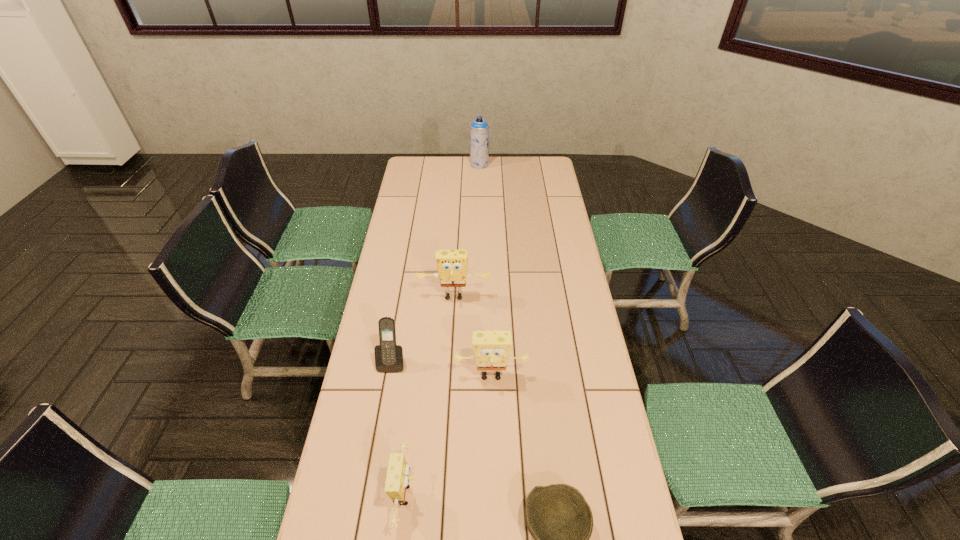
Identify which object is the closest to the leftmost object. Please provide its 2D coordinates. Your answer should be formatted as a tuple, i.e. [(x, y)], where the tuple contains the x and y coordinates of a point satisfying the conditions above.

[(491, 349)]

Identify the location of the third closest object to the second farthest object. The width and height of the screenshot is (960, 540). (397, 479).

Identify which sponge is the second closest to the bowl. Please provide its 2D coordinates. Your answer should be formatted as a tuple, i.e. [(x, y)], where the tuple contains the x and y coordinates of a point satisfying the conditions above.

[(491, 349)]

The height and width of the screenshot is (540, 960). Find the location of `sponge that is the third closest to the leftmost object`. sponge that is the third closest to the leftmost object is located at coordinates (397, 479).